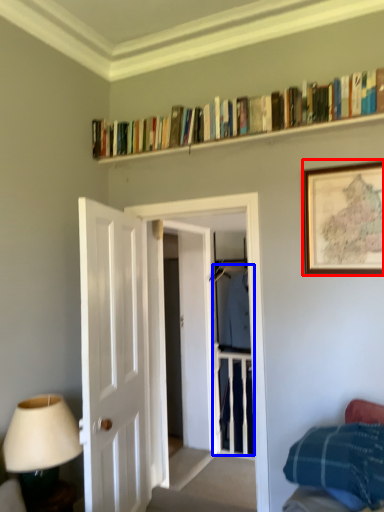
Question: Which point is closer to the camera, picture frame (highlighted by a red box) or clothing (highlighted by a blue box)?

Choices:
 (A) picture frame
 (B) clothing

Answer: (A)